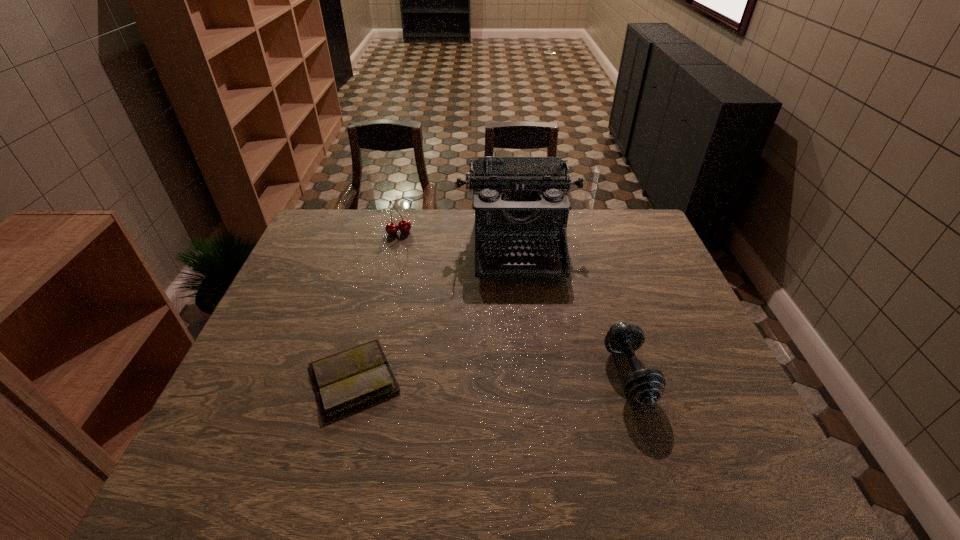
Image resolution: width=960 pixels, height=540 pixels. I want to click on vacant area that lies between the diary and the dumbbell, so click(492, 376).

The height and width of the screenshot is (540, 960). Identify the location of vacant area that lies between the third tallest object and the typewriter. (573, 309).

Locate which object ranks in proximity to the shortest object. Please provide its 2D coordinates. Your answer should be formatted as a tuple, i.e. [(x, y)], where the tuple contains the x and y coordinates of a point satisfying the conditions above.

[(519, 201)]

Find the location of a particular element. This screenshot has height=540, width=960. object that is the second closest one to the second tallest object is located at coordinates (345, 381).

You are a GUI agent. You are given a task and a screenshot of the screen. Output one action in this format:
    pyautogui.click(x=<x>, y=<y>)
    Task: Click on the vacant space that satisfies the following two spatial constraints: 1. on the back side of the diary; 2. on the right side of the typewriter
    
    Given the screenshot: What is the action you would take?
    point(389,245)

Locate an element on the screen. This screenshot has height=540, width=960. vacant space that satisfies the following two spatial constraints: 1. on the front side of the typewriter; 2. on the left side of the second shortest object is located at coordinates (532, 374).

What are the coordinates of `blank area in the image that satisfies the following two spatial constraints: 1. on the back side of the shortest object; 2. on the left side of the cherry` in the screenshot? It's located at (392, 232).

Where is `vacant space that satisfies the following two spatial constraints: 1. on the back side of the diary; 2. on the right side of the tallest object`? vacant space that satisfies the following two spatial constraints: 1. on the back side of the diary; 2. on the right side of the tallest object is located at coordinates (389, 245).

Where is `vacant space that satisfies the following two spatial constraints: 1. on the back side of the second shortest object; 2. on the left side of the shortest object`? The height and width of the screenshot is (540, 960). vacant space that satisfies the following two spatial constraints: 1. on the back side of the second shortest object; 2. on the left side of the shortest object is located at coordinates (354, 374).